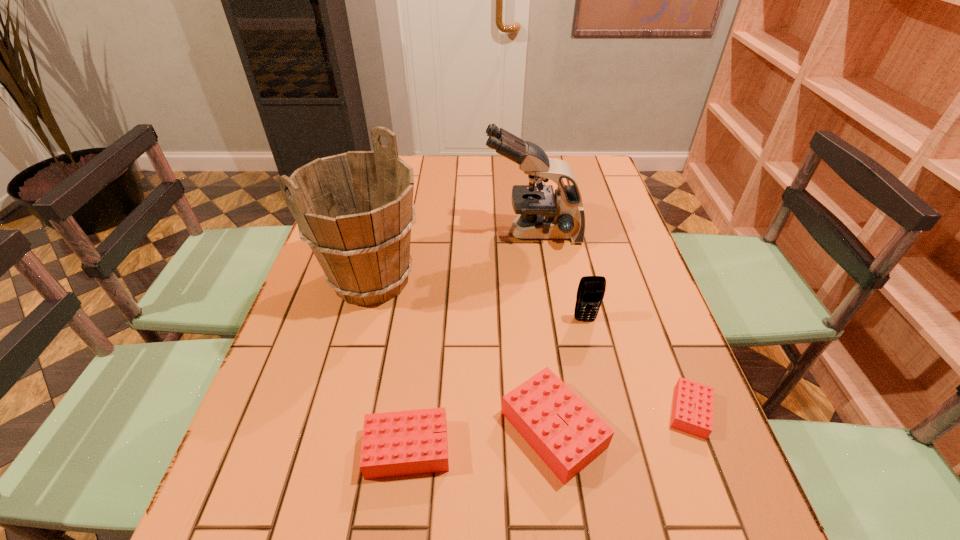
At what (x,y) coordinates should I click in order to perform the action: click on unoccupied area between the fifth tallest object and the second Lego from right to left. Please return your answer as a coordinate pair (x, y). This screenshot has width=960, height=540. Looking at the image, I should click on point(481,439).

The image size is (960, 540). What are the coordinates of `vacant area that lies between the second Lego from right to left and the third tallest object` in the screenshot? It's located at (569, 375).

Locate an element on the screen. Image resolution: width=960 pixels, height=540 pixels. free space that is in between the shortest Lego and the bucket is located at coordinates (531, 346).

Identify which object is the fifth closest to the cellular telephone. Please provide its 2D coordinates. Your answer should be formatted as a tuple, i.e. [(x, y)], where the tuple contains the x and y coordinates of a point satisfying the conditions above.

[(401, 443)]

Choose which object is the second nearest neighbor to the leftmost Lego. Please provide its 2D coordinates. Your answer should be formatted as a tuple, i.e. [(x, y)], where the tuple contains the x and y coordinates of a point satisfying the conditions above.

[(355, 210)]

Identify which Lego is the third closest to the bucket. Please provide its 2D coordinates. Your answer should be formatted as a tuple, i.e. [(x, y)], where the tuple contains the x and y coordinates of a point satisfying the conditions above.

[(693, 403)]

Image resolution: width=960 pixels, height=540 pixels. What are the coordinates of `Lego that can be found as the second closest to the shortest object` in the screenshot? It's located at (401, 443).

This screenshot has width=960, height=540. In order to click on free spot that satisfies the following two spatial constraints: 1. on the screen of the rightmost object; 2. on the left side of the cellular telephone in this screenshot , I will do `click(606, 411)`.

This screenshot has height=540, width=960. Find the location of `vacant space that satisfies the following two spatial constraints: 1. on the front side of the second Lego from left to right; 2. on the right side of the bucket`. vacant space that satisfies the following two spatial constraints: 1. on the front side of the second Lego from left to right; 2. on the right side of the bucket is located at coordinates (333, 430).